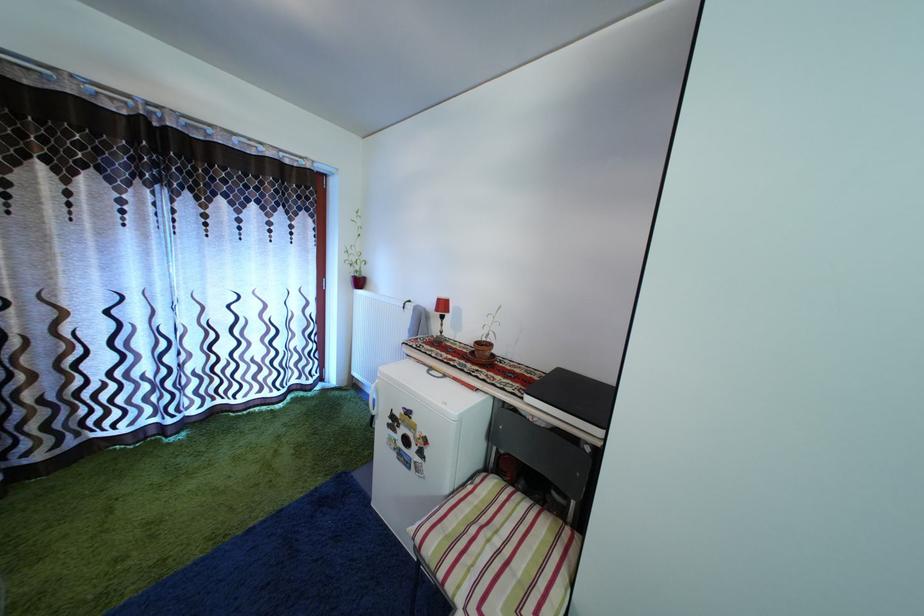
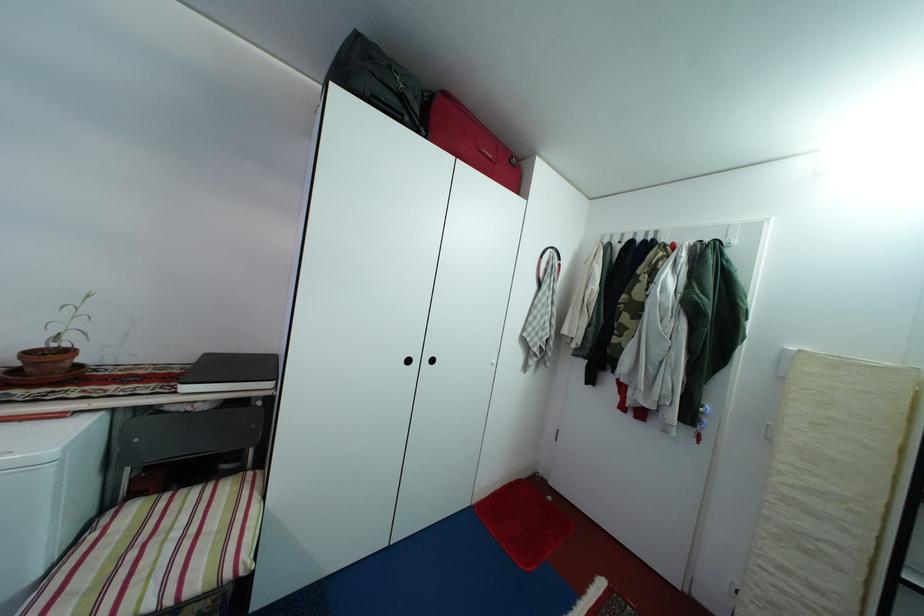
The point at (485, 350) is marked in the first image. Where is the corresponding point in the second image?

(38, 361)